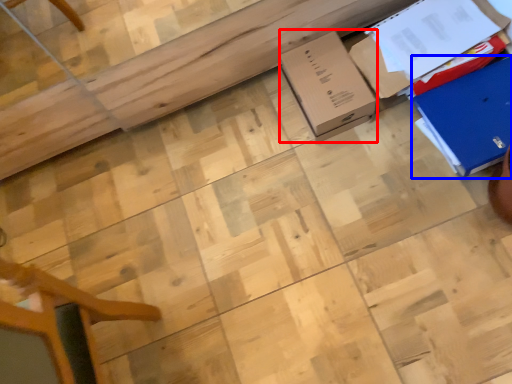
Question: Which point is closer to the camera, cardboard box (highlighted by a red box) or cardboard box (highlighted by a blue box)?

Choices:
 (A) cardboard box
 (B) cardboard box

Answer: (B)